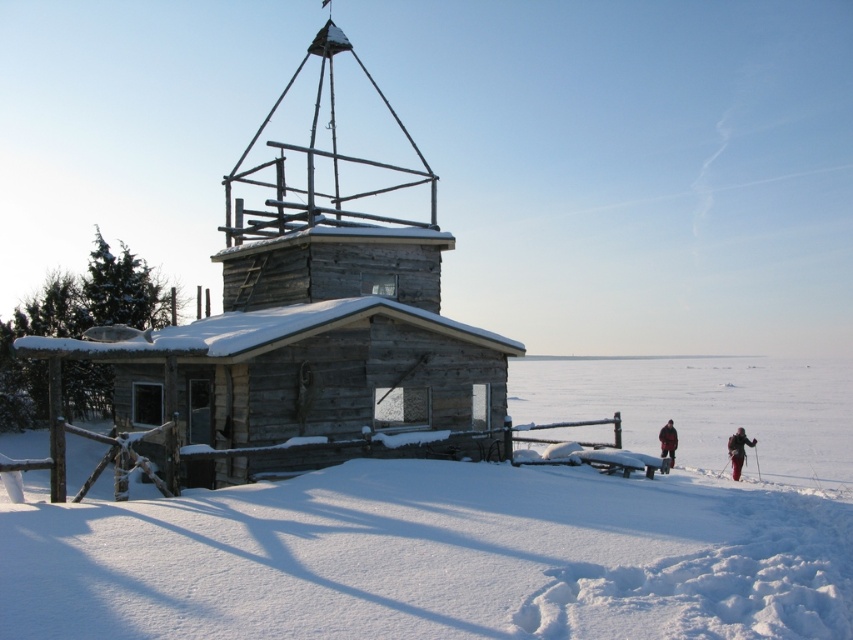
Looking at this image, can you confirm if dark red ski suit at lower right is positioned to the left of dark red fabric jacket at lower right?

Correct, you'll find dark red ski suit at lower right to the left of dark red fabric jacket at lower right.

At what (x,y) coordinates should I click in order to perform the action: click on dark red ski suit at lower right. Please return your answer as a coordinate pair (x, y). Looking at the image, I should click on (737, 451).

Is white snow at lower left positioned behind dark red fabric jacket at lower right?

No, white snow at lower left is closer to the viewer.

The width and height of the screenshot is (853, 640). I want to click on white snow at lower left, so click(x=486, y=529).

Is white snow at lower left to the left of dark red ski suit at lower right from the viewer's perspective?

Indeed, white snow at lower left is positioned on the left side of dark red ski suit at lower right.

In order to click on white snow at lower left in this screenshot , I will do `click(486, 529)`.